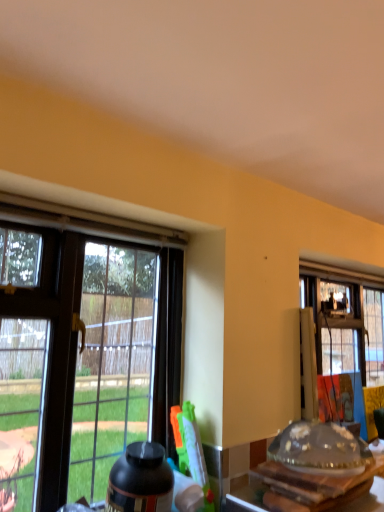
Question: Considering their positions, is black matte bottle at lower center located in front of or behind transparent glass table at lower right?

Choices:
 (A) behind
 (B) front

Answer: (A)

Question: Looking at the image, does black matte bottle at lower center seem bigger or smaller compared to transparent glass table at lower right?

Choices:
 (A) small
 (B) big

Answer: (A)

Question: Which is farther from the transparent glass window at left?

Choices:
 (A) transparent glass table at lower right
 (B) black matte bottle at lower center

Answer: (A)

Question: Estimate the real-world distances between objects in this image. Which object is closer to the transparent glass window at left?

Choices:
 (A) black matte bottle at lower center
 (B) transparent glass table at lower right

Answer: (A)